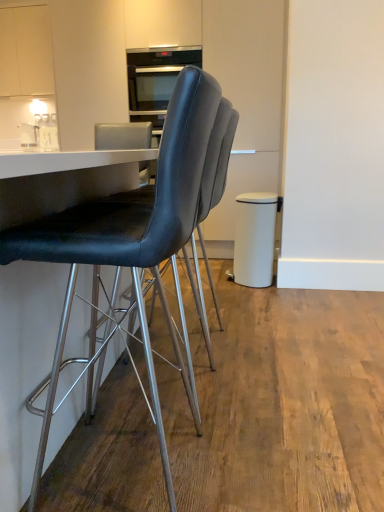
Question: Based on their positions, is white glossy salt shaker at upper left, which is the 2th appliance from right to left, located to the left or right of black leather chair at center, the 1th chair from the back?

Choices:
 (A) right
 (B) left

Answer: (B)

Question: Looking at the image, does white glossy salt shaker at upper left, the 2th appliance from the front, seem bigger or smaller compared to black leather chair at center, the 1th chair from the back?

Choices:
 (A) big
 (B) small

Answer: (B)

Question: Considering the real-world distances, which object is farthest from the white glossy salt shaker at upper left, marked as the 1th appliance in a back-to-front arrangement?

Choices:
 (A) black leather chair at center, arranged as the 1th chair when viewed from the front
 (B) white matte cabinet at upper left
 (C) white matte trash can at right
 (D) black leather chair at center, placed as the 2th chair when sorted from front to back
 (E) matte black oven at upper center, arranged as the 2th appliance when viewed from the back

Answer: (A)

Question: Which of these objects is positioned closest to the white glossy salt shaker at upper left, which is the 2th appliance from right to left?

Choices:
 (A) black leather chair at center, arranged as the 1th chair when viewed from the front
 (B) white matte cabinet at upper left
 (C) matte black oven at upper center, arranged as the 2th appliance when viewed from the back
 (D) black leather chair at center, placed as the 2th chair when sorted from front to back
 (E) white matte trash can at right

Answer: (B)